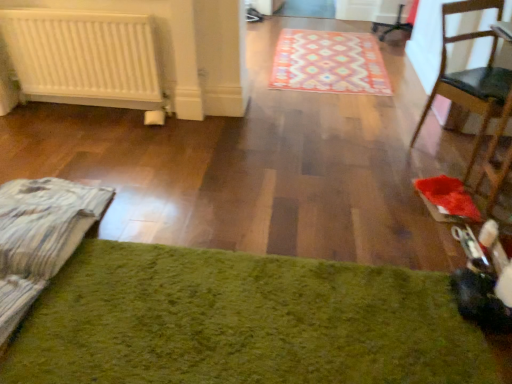
At what (x,y) coordinates should I click in order to perform the action: click on free space that is to the left of white matte radiator at left. Please return your answer as a coordinate pair (x, y). This screenshot has width=512, height=384. Looking at the image, I should click on (42, 117).